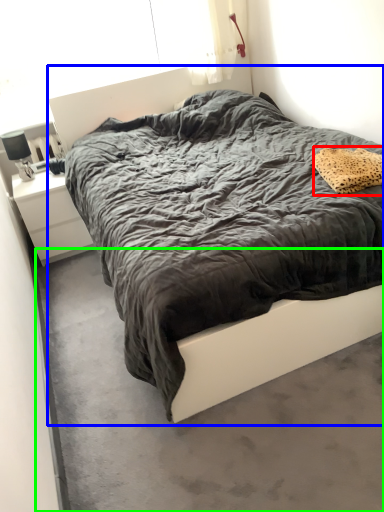
Question: Which object is positioned farthest from pillow (highlighted by a red box)? Select from bed (highlighted by a blue box) and concrete (highlighted by a green box).

Choices:
 (A) bed
 (B) concrete

Answer: (B)